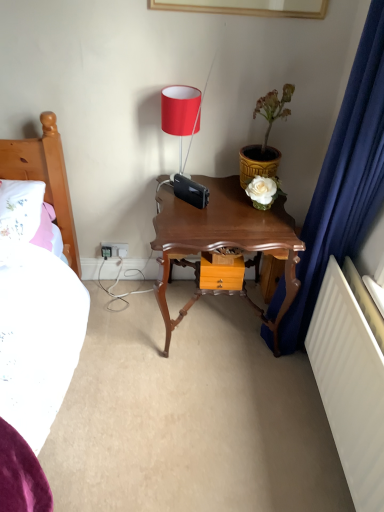
Find the location of a particular element. The image size is (384, 512). free point above matte red lampshade at upper center (from a real-world perspective) is located at coordinates (178, 90).